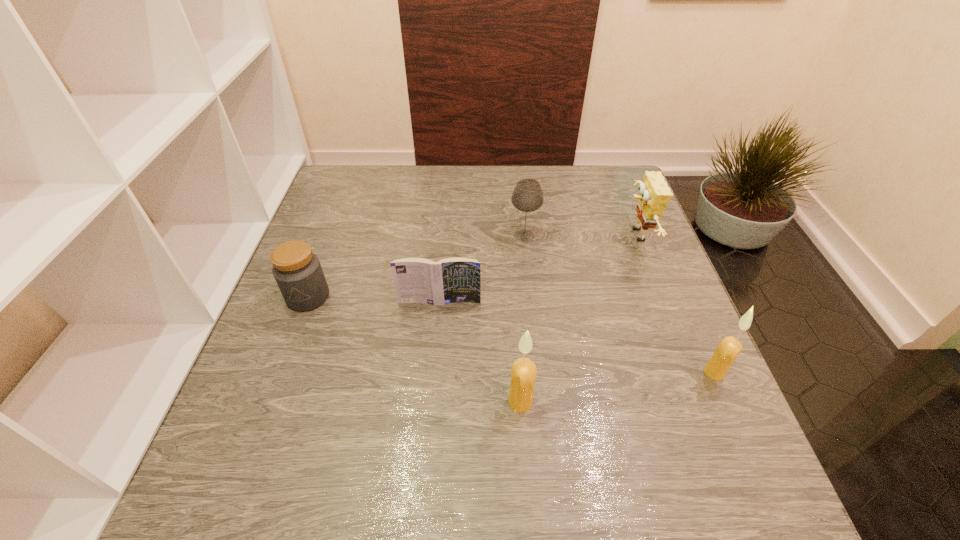
Locate an element on the screen. The width and height of the screenshot is (960, 540). vacant place for an extra candle on the left is located at coordinates (304, 434).